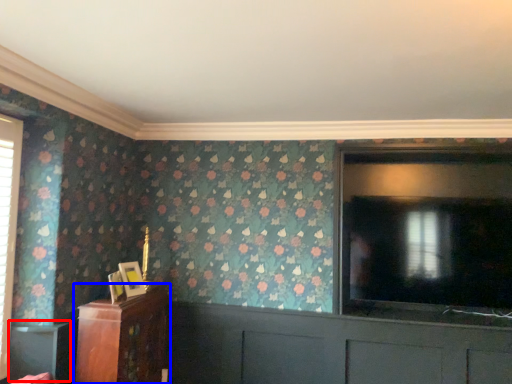
Question: Which object appears farthest to the camera in this image, table (highlighted by a red box) or furniture (highlighted by a blue box)?

Choices:
 (A) table
 (B) furniture

Answer: (B)